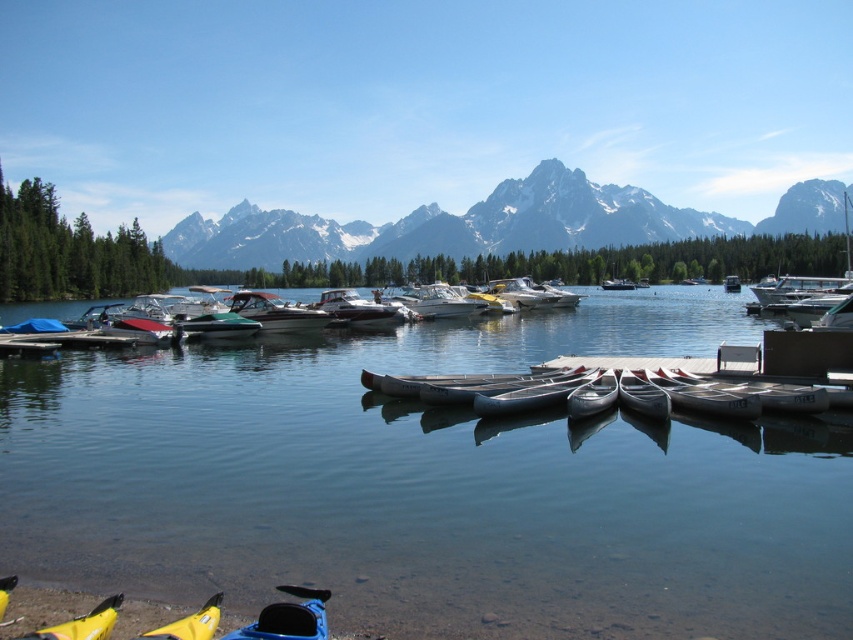
Is white plastic canoe at center shorter than white glossy boat at center?

Yes.

Which of these two, white plastic canoe at center or white glossy boat at center, stands shorter?

Standing shorter between the two is white plastic canoe at center.

Measure the distance between white plastic canoe at center and camera.

A distance of 97.10 feet exists between white plastic canoe at center and camera.

Image resolution: width=853 pixels, height=640 pixels. What are the coordinates of `white plastic canoe at center` in the screenshot? It's located at (532, 394).

Can you confirm if yellow matte kayak at lower left is smaller than white glossy boat at center?

Yes.

Looking at this image, can you confirm if yellow matte kayak at lower left is wider than white glossy boat at center?

No.

Identify the location of yellow matte kayak at lower left. [x=83, y=624].

Can you confirm if white glossy boat at center is smaller than white plastic boat at center?

Indeed, white glossy boat at center has a smaller size compared to white plastic boat at center.

How much distance is there between white glossy boat at center and white plastic boat at center?

white glossy boat at center is 87.65 meters away from white plastic boat at center.

Does point (473, 301) come in front of point (729, 285)?

Yes, it is in front of point (729, 285).

I want to click on white glossy boat at center, so click(x=438, y=301).